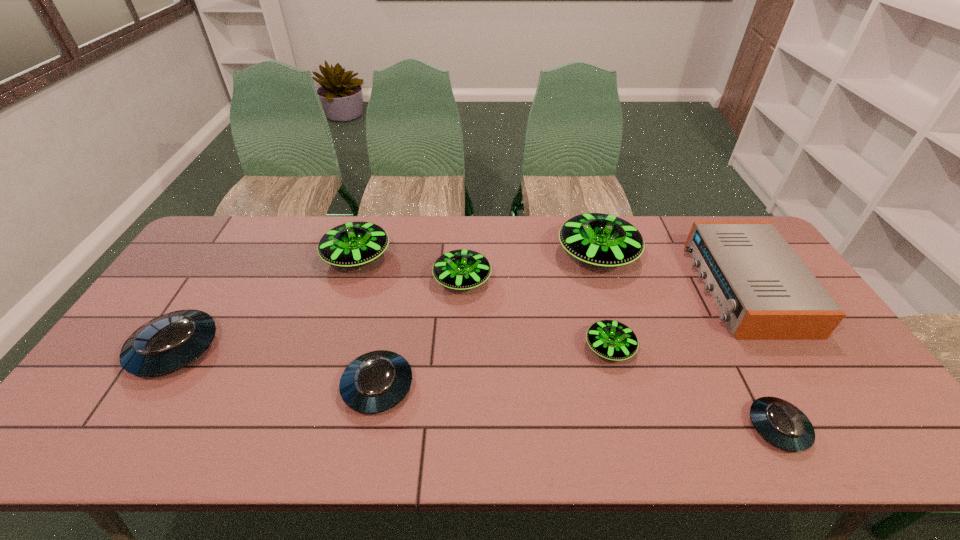
Identify the location of blank space located 0.320m on the right of the nearest green saucer. (754, 348).

This screenshot has height=540, width=960. What are the coordinates of `free region located 0.160m on the right of the second biggest gray saucer` in the screenshot? It's located at (477, 386).

Locate an element on the screen. vacant space located 0.060m on the right of the shortest object is located at coordinates (832, 427).

Where is `radio receiver that is at the far edge`? radio receiver that is at the far edge is located at coordinates (764, 291).

Where is `object that is at the left edge`? The width and height of the screenshot is (960, 540). object that is at the left edge is located at coordinates (169, 342).

This screenshot has height=540, width=960. What are the coordinates of `object that is at the right edge` in the screenshot? It's located at 764,291.

The height and width of the screenshot is (540, 960). Find the location of `object at the far right corner`. object at the far right corner is located at coordinates (764, 291).

The height and width of the screenshot is (540, 960). I want to click on vacant space at the far edge of the desktop, so click(x=281, y=230).

What are the coordinates of `blank space at the near edge of the desktop` in the screenshot? It's located at (554, 454).

Locate an element on the screen. This screenshot has height=540, width=960. vacant space at the left edge of the desktop is located at coordinates (167, 291).